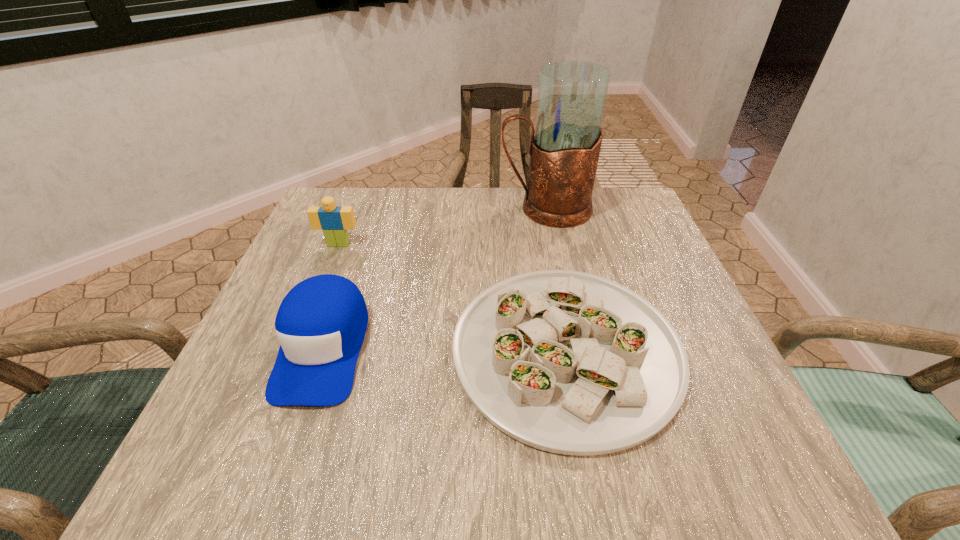
I want to click on vacant area that satisfies the following two spatial constraints: 1. with the handle on the side of the pitcher; 2. on the face of the Lego, so pos(553,244).

This screenshot has width=960, height=540. What are the coordinates of `vacant space that satisfies the following two spatial constraints: 1. on the front-facing side of the baseball cap; 2. on the right side of the platter` in the screenshot? It's located at (323, 350).

The height and width of the screenshot is (540, 960). What are the coordinates of `vacant region that satisfies the following two spatial constraints: 1. with the handle on the side of the farthest object; 2. on the front-facing side of the baseball cap` in the screenshot? It's located at (574, 347).

I want to click on free location that satisfies the following two spatial constraints: 1. with the handle on the side of the tallest object; 2. on the front-facing side of the baseball cap, so click(x=574, y=347).